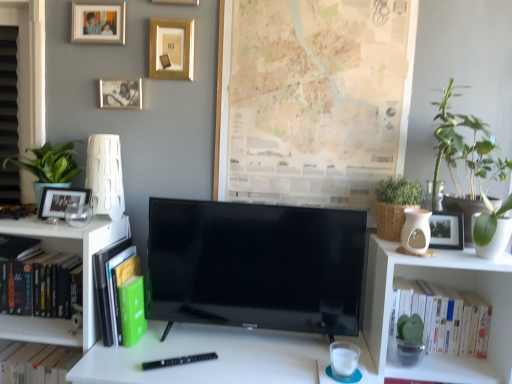
Locate an element on the screen. Image resolution: width=512 pixels, height=384 pixels. vacant space in black glossy tv at center (from a real-world perspective) is located at coordinates (248, 342).